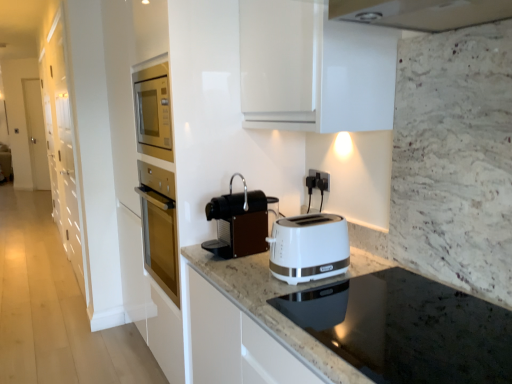
Question: Is black plastic electrical outlet at center to the right of black granite countertop at lower center from the viewer's perspective?

Choices:
 (A) no
 (B) yes

Answer: (A)

Question: Considering the relative sizes of black plastic electrical outlet at center and black granite countertop at lower center in the image provided, is black plastic electrical outlet at center thinner than black granite countertop at lower center?

Choices:
 (A) no
 (B) yes

Answer: (B)

Question: Is black plastic electrical outlet at center wider than black granite countertop at lower center?

Choices:
 (A) no
 (B) yes

Answer: (A)

Question: Considering the relative sizes of black plastic electrical outlet at center and black granite countertop at lower center in the image provided, is black plastic electrical outlet at center smaller than black granite countertop at lower center?

Choices:
 (A) yes
 (B) no

Answer: (A)

Question: Is black plastic electrical outlet at center looking in the opposite direction of black granite countertop at lower center?

Choices:
 (A) no
 (B) yes

Answer: (A)

Question: From a real-world perspective, is brown matte coffee machine at center above or below white glossy cabinet at left?

Choices:
 (A) above
 (B) below

Answer: (B)

Question: Considering the positions of brown matte coffee machine at center and white glossy cabinet at left in the image, is brown matte coffee machine at center taller or shorter than white glossy cabinet at left?

Choices:
 (A) short
 (B) tall

Answer: (A)

Question: Would you say brown matte coffee machine at center is to the left or to the right of white glossy cabinet at left in the picture?

Choices:
 (A) right
 (B) left

Answer: (A)

Question: From the image's perspective, is brown matte coffee machine at center located above or below white glossy cabinet at left?

Choices:
 (A) below
 (B) above

Answer: (A)

Question: From a real-world perspective, is white glossy cabinet at left above or below brown matte coffee machine at center?

Choices:
 (A) below
 (B) above

Answer: (B)

Question: Is white glossy cabinet at left bigger or smaller than brown matte coffee machine at center?

Choices:
 (A) big
 (B) small

Answer: (A)

Question: Is white glossy cabinet at left situated inside brown matte coffee machine at center or outside?

Choices:
 (A) inside
 (B) outside

Answer: (B)

Question: Considering the relative positions of white glossy cabinet at left and brown matte coffee machine at center in the image provided, is white glossy cabinet at left to the left or to the right of brown matte coffee machine at center?

Choices:
 (A) left
 (B) right

Answer: (A)

Question: From a real-world perspective, is white plastic toaster at center positioned above or below black plastic electrical outlet at center?

Choices:
 (A) above
 (B) below

Answer: (B)

Question: Is white plastic toaster at center situated inside black plastic electrical outlet at center or outside?

Choices:
 (A) outside
 (B) inside

Answer: (A)